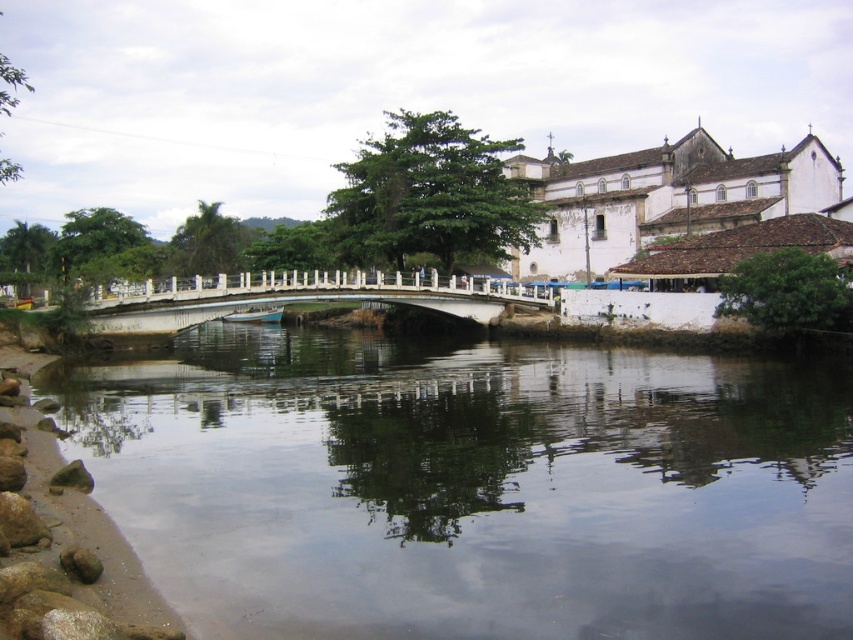
Question: Which point is farther to the camera?

Choices:
 (A) clear water at center
 (B) white concrete bridge at center
 (C) light blue wooden boat at center

Answer: (C)

Question: Is white concrete bridge at center positioned in front of light blue wooden boat at center?

Choices:
 (A) no
 (B) yes

Answer: (B)

Question: Is clear water at center smaller than white concrete bridge at center?

Choices:
 (A) no
 (B) yes

Answer: (A)

Question: Is white concrete bridge at center positioned in front of light blue wooden boat at center?

Choices:
 (A) no
 (B) yes

Answer: (B)

Question: Among these objects, which one is farthest from the camera?

Choices:
 (A) clear water at center
 (B) light blue wooden boat at center

Answer: (B)

Question: Which of the following is the farthest from the observer?

Choices:
 (A) clear water at center
 (B) white concrete bridge at center

Answer: (B)